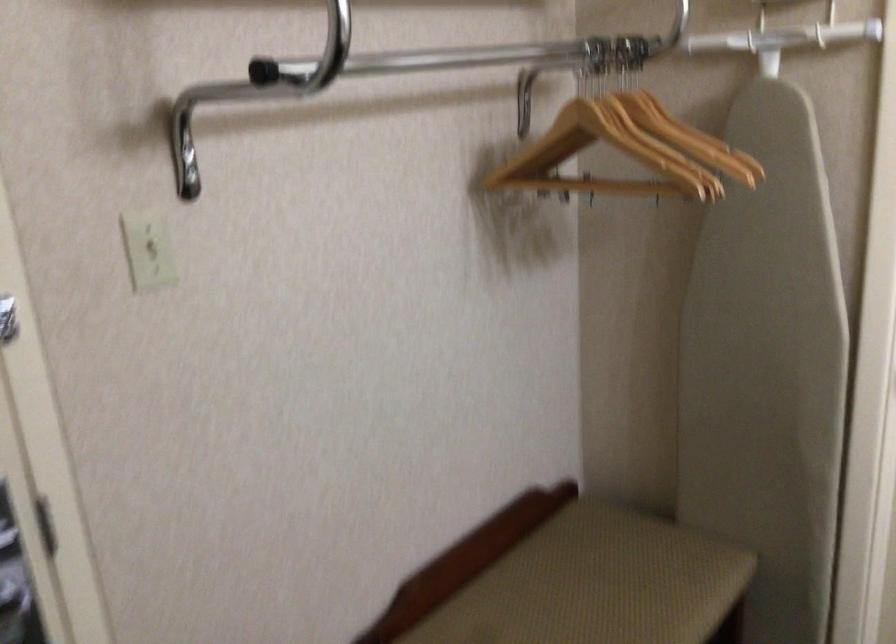
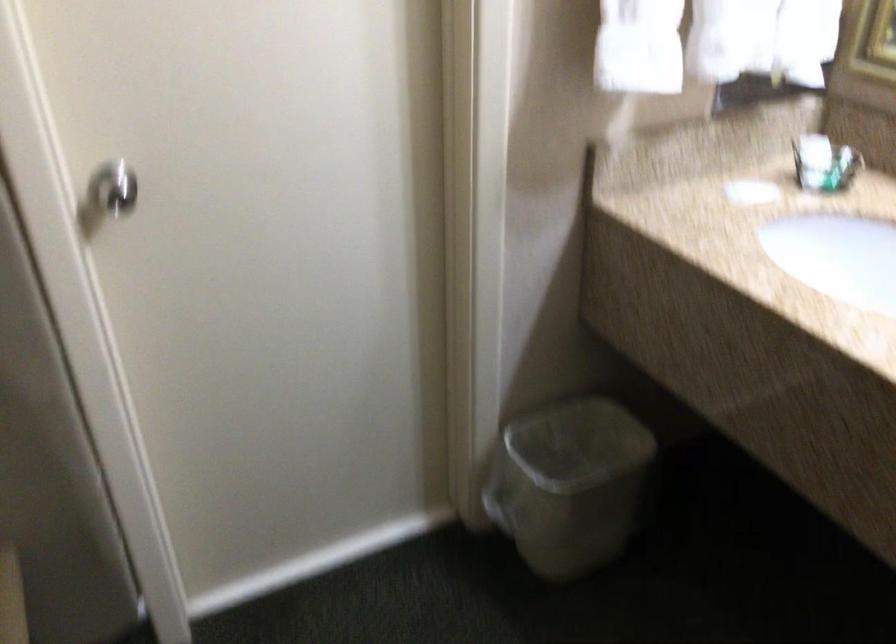
First-person continuous shooting, in which direction is the camera rotating?

The camera rotated toward right-down.